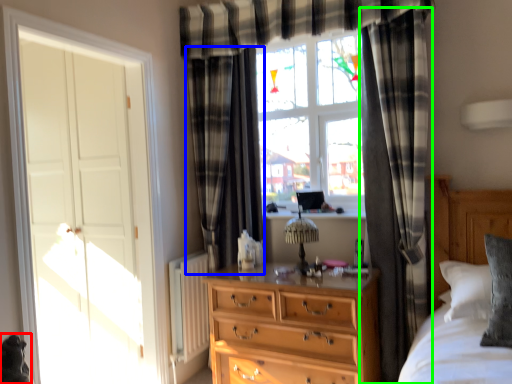
Question: Based on their relative distances, which object is farther from animal (highlighted by a red box)? Choose from curtain (highlighted by a blue box) and curtain (highlighted by a green box).

Choices:
 (A) curtain
 (B) curtain

Answer: (B)